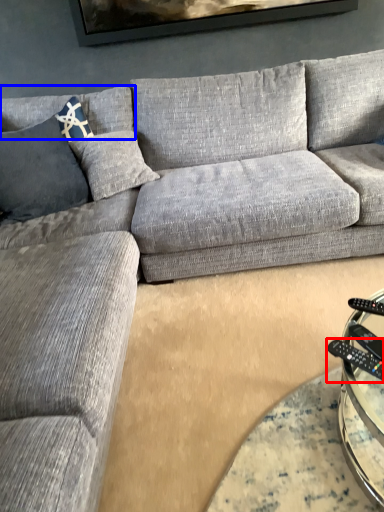
Question: Which object is further to the camera taking this photo, control (highlighted by a red box) or pillow (highlighted by a blue box)?

Choices:
 (A) control
 (B) pillow

Answer: (B)